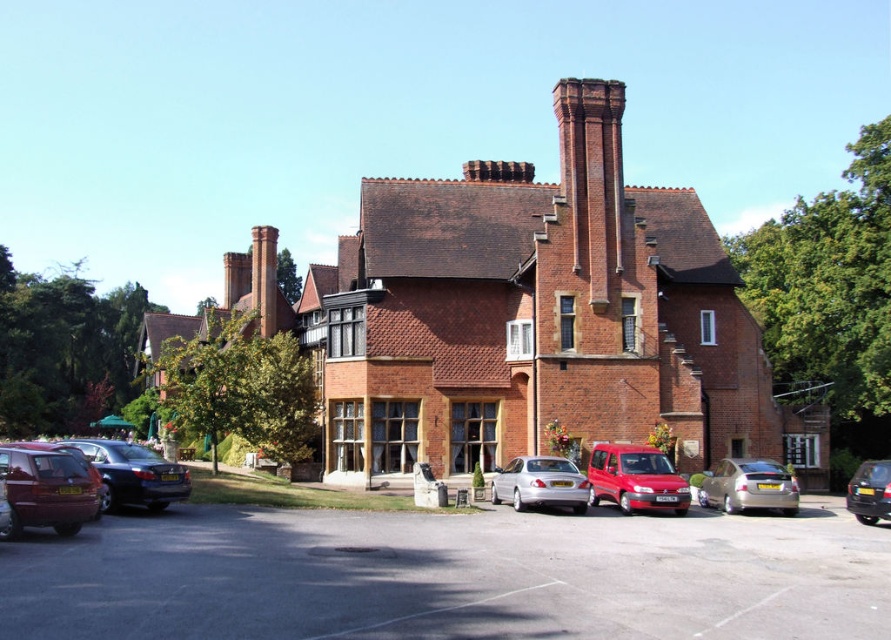
You are standing at the entrance of the grand red brick building and want to locate two specific points marked on the parking lot. The first point is at coordinates point (x=68, y=461) and the second is at point (x=883, y=486). Based on the scene description, which of these two points is closer to the building?

Point (x=68, y=461) is in front of point (x=883, y=486), so it is closer to the building.